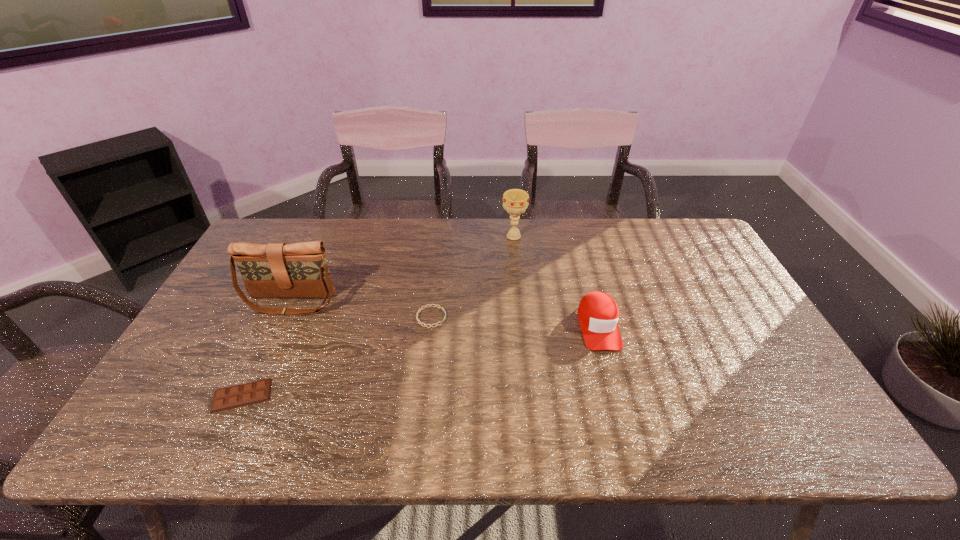
The width and height of the screenshot is (960, 540). What are the coordinates of `free spot between the nearest object and the fourth object from left to right` in the screenshot? It's located at (378, 316).

Image resolution: width=960 pixels, height=540 pixels. What are the coordinates of `vacant area that lies between the farthest object and the bracelet` in the screenshot? It's located at (472, 276).

The width and height of the screenshot is (960, 540). I want to click on free point between the fourth shortest object and the chocolate bar, so click(x=378, y=316).

Identify which object is located as the fourth nearest to the nearest object. Please provide its 2D coordinates. Your answer should be formatted as a tuple, i.e. [(x, y)], where the tuple contains the x and y coordinates of a point satisfying the conditions above.

[(515, 201)]

At what (x,y) coordinates should I click in order to perform the action: click on object that is the second nearest to the fourth object from left to right. Please return your answer as a coordinate pair (x, y). Looking at the image, I should click on pos(420,309).